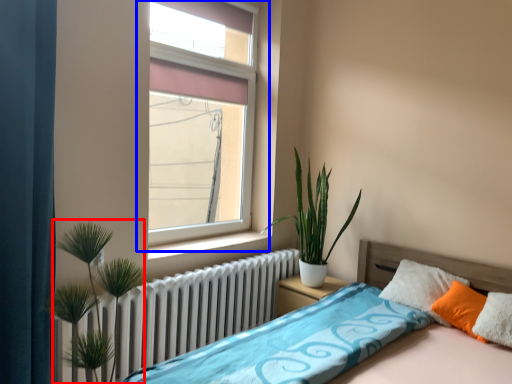
Question: Which object appears farthest to the camera in this image, vegetation (highlighted by a red box) or window (highlighted by a blue box)?

Choices:
 (A) vegetation
 (B) window

Answer: (B)